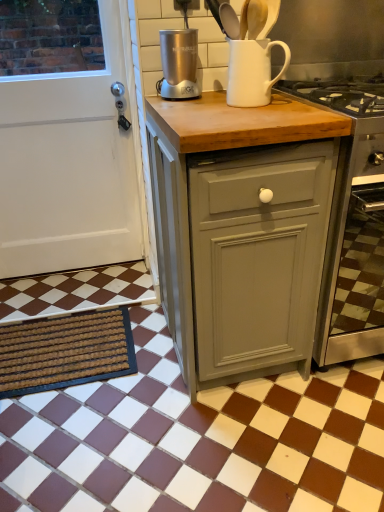
This screenshot has height=512, width=384. In order to click on free point in front of white matte jug at upper center in this screenshot , I will do `click(256, 111)`.